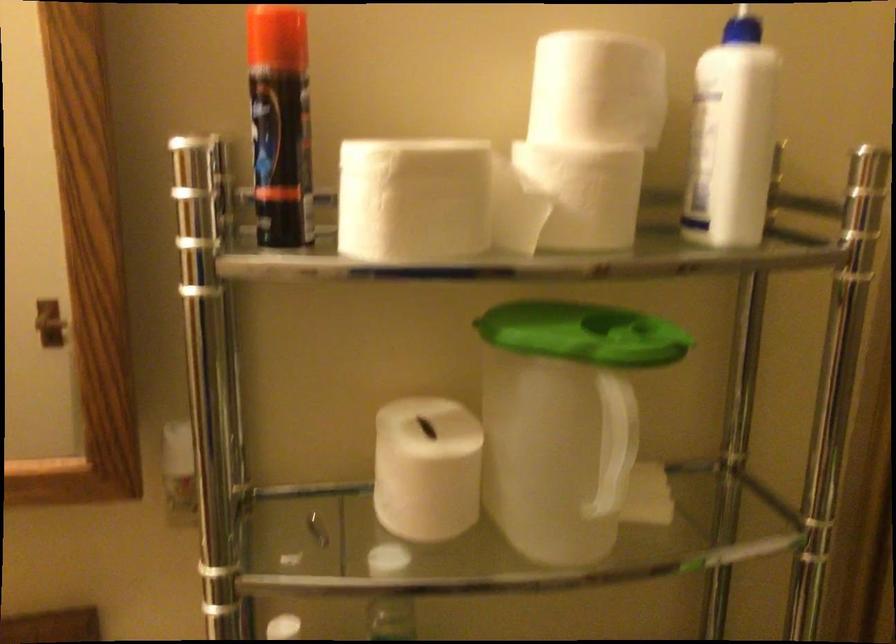
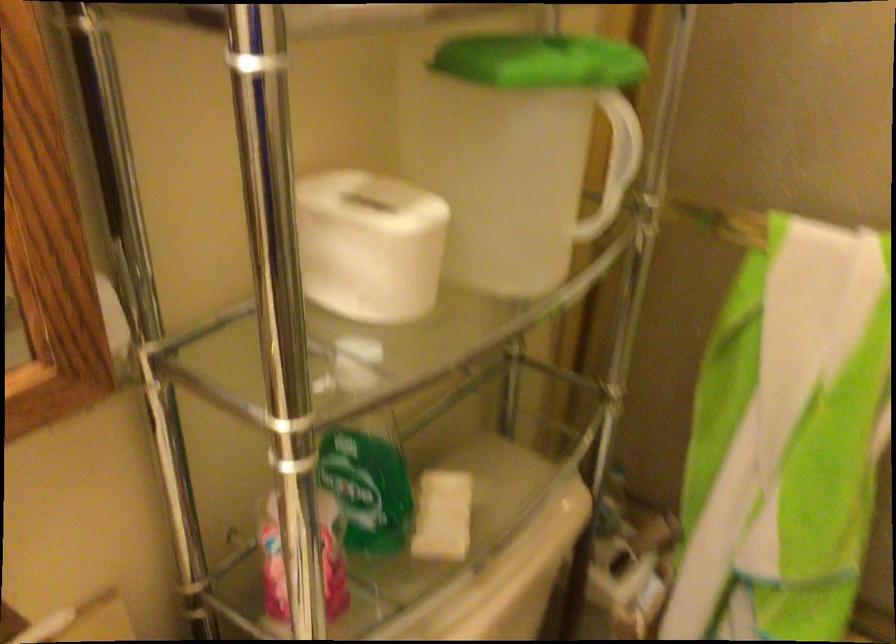
Locate, in the second image, the point that corresponds to (x=543, y=328) in the first image.

(539, 61)